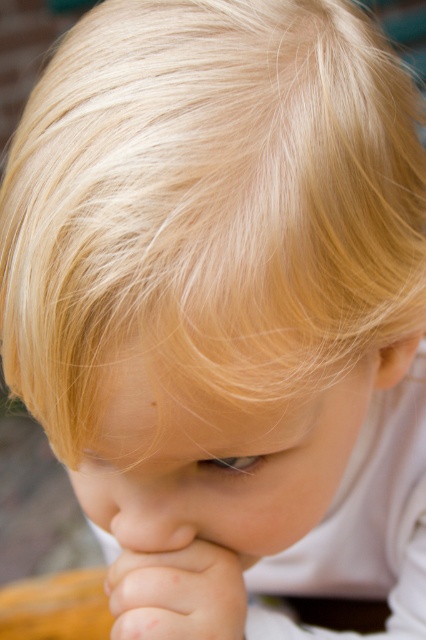
Is blonde silky hair at upper center closer to the viewer compared to smooth skin hand at lower center?

That is True.

Measure the distance from blonde silky hair at upper center to smooth skin hand at lower center.

blonde silky hair at upper center is 11.33 inches from smooth skin hand at lower center.

You are a GUI agent. You are given a task and a screenshot of the screen. Output one action in this format:
    pyautogui.click(x=<x>, y=<y>)
    Task: Click on the blonde silky hair at upper center
    Image resolution: width=426 pixels, height=640 pixels.
    Given the screenshot: What is the action you would take?
    pyautogui.click(x=210, y=204)